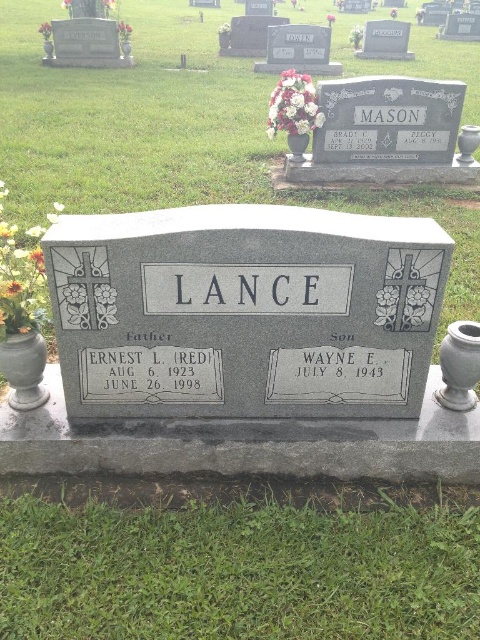
Consider the image. Which of these two, black stone text at center or orange matte vase at center, stands taller?

Standing taller between the two is orange matte vase at center.

Who is more distant from viewer, (x=360, y=362) or (x=64, y=4)?

Point (x=64, y=4)

Find the location of a particular element. The width and height of the screenshot is (480, 640). black stone text at center is located at coordinates (343, 364).

Which of these two, matte yellow flower at left or matte white vase at upper left, stands shorter?

Standing shorter between the two is matte yellow flower at left.

Does point (0, 186) come in front of point (48, 32)?

Yes, point (0, 186) is closer to viewer.

Locate an element on the screen. The height and width of the screenshot is (640, 480). matte yellow flower at left is located at coordinates (21, 276).

Between floral bouquet at upper center and white floral bouquet at center, which one appears on the right side from the viewer's perspective?

From the viewer's perspective, floral bouquet at upper center appears more on the right side.

Which is more to the left, floral bouquet at upper center or white floral bouquet at center?

From the viewer's perspective, white floral bouquet at center appears more on the left side.

Between point (303, 118) and point (222, 29), which one is positioned behind?

Point (222, 29)

This screenshot has width=480, height=640. I want to click on floral bouquet at upper center, so click(x=294, y=106).